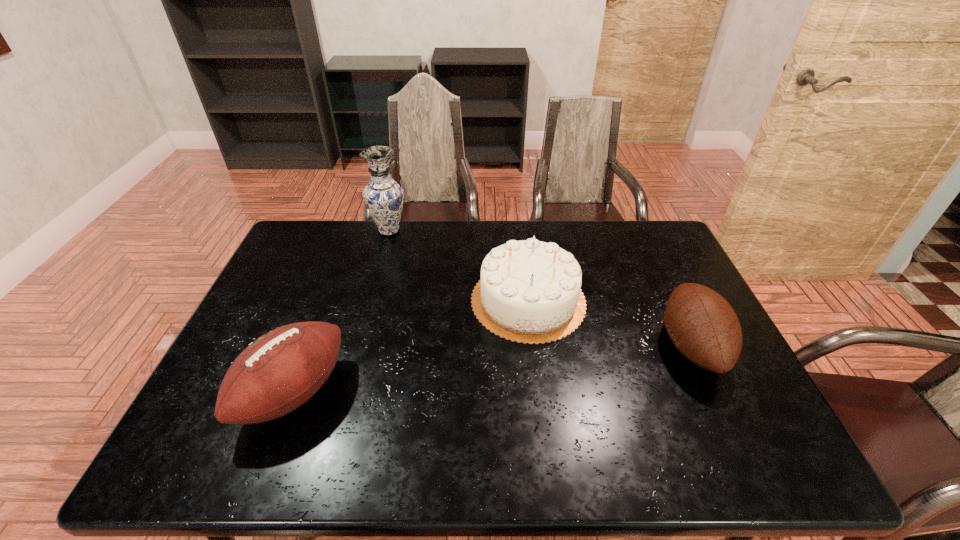
The width and height of the screenshot is (960, 540). Find the location of `vacant space located 0.160m on the laces of the right football`. vacant space located 0.160m on the laces of the right football is located at coordinates (601, 346).

Find the location of `object that is at the far edge`. object that is at the far edge is located at coordinates (383, 196).

Locate an element on the screen. object at the near edge is located at coordinates (281, 370).

The width and height of the screenshot is (960, 540). What are the coordinates of `object that is positioned at the left edge` in the screenshot? It's located at (281, 370).

You are a GUI agent. You are given a task and a screenshot of the screen. Output one action in this format:
    pyautogui.click(x=<x>, y=<y>)
    Task: Click on the object positioned at the right edge
    
    Given the screenshot: What is the action you would take?
    pyautogui.click(x=703, y=326)

Locate an element on the screen. object at the near left corner is located at coordinates (281, 370).

In the image, there is a desktop. Where is `free space at the far edge`? free space at the far edge is located at coordinates (507, 220).

This screenshot has height=540, width=960. In the image, there is a desktop. In order to click on vacant space at the near edge in this screenshot , I will do `click(370, 441)`.

The width and height of the screenshot is (960, 540). In the image, there is a desktop. In order to click on vacant space at the left edge in this screenshot , I will do `click(278, 301)`.

Locate an element on the screen. vacant space at the right edge is located at coordinates (734, 433).